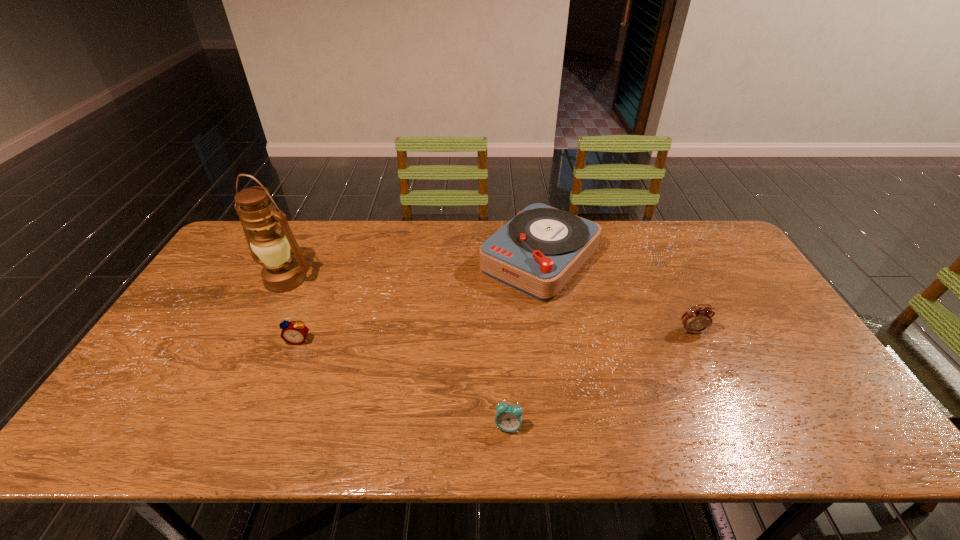
The height and width of the screenshot is (540, 960). Identify the location of alarm clock that is the second closest one to the tallest object. (508, 418).

Where is `alarm clock that is the closest to the leftmost alarm clock`? This screenshot has height=540, width=960. alarm clock that is the closest to the leftmost alarm clock is located at coordinates (508, 418).